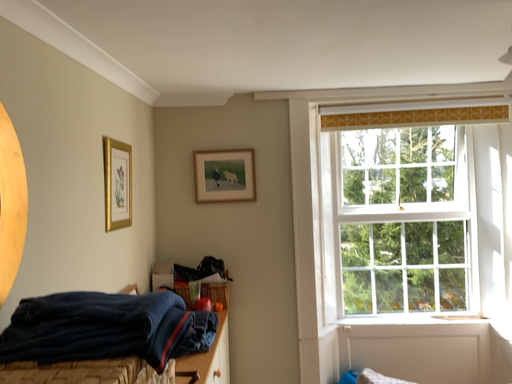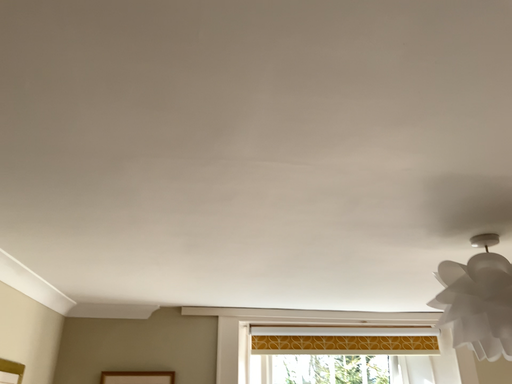
Question: Which way did the camera rotate in the video?

Choices:
 (A) rotated left
 (B) rotated right

Answer: (B)